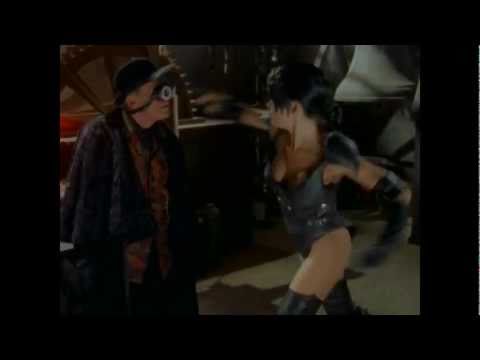
Find the location of `floor`. floor is located at coordinates (389, 288).